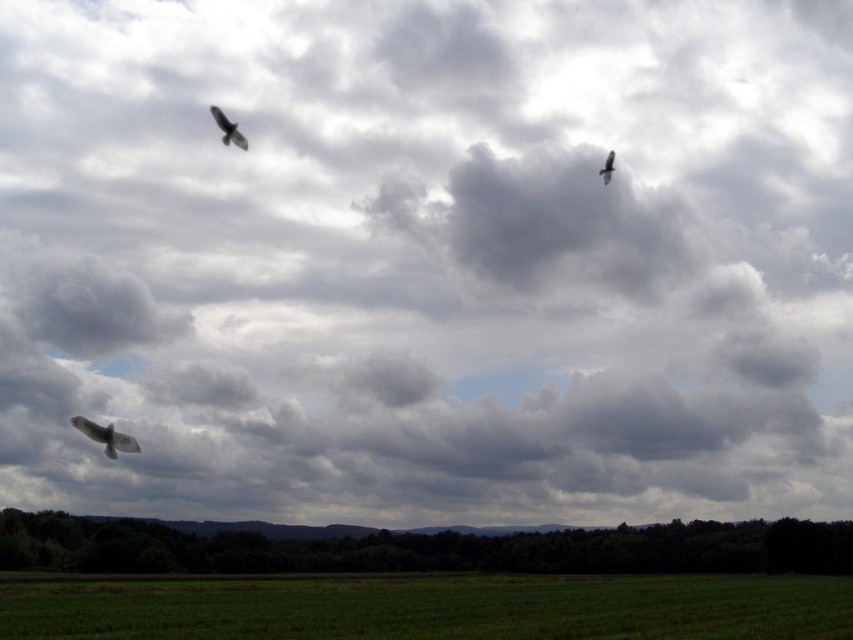
Question: Is green grassy field at lower center smaller than dark gray feathers at upper right?

Choices:
 (A) yes
 (B) no

Answer: (A)

Question: Estimate the real-world distances between objects in this image. Which object is closer to the dark gray feathers at upper left?

Choices:
 (A) white feathered bird at lower left
 (B) dark gray feathers at upper right
 (C) green grassy field at lower center

Answer: (A)

Question: Can you confirm if green grassy field at lower center is smaller than white feathered bird at lower left?

Choices:
 (A) yes
 (B) no

Answer: (B)

Question: Which point is farther to the camera?

Choices:
 (A) white feathered bird at lower left
 (B) dark gray feathers at upper left

Answer: (B)

Question: Which point is farther to the camera?

Choices:
 (A) green grassy field at lower center
 (B) dark gray feathers at upper right
 (C) dark gray feathers at upper left

Answer: (A)

Question: Can you confirm if green grassy field at lower center is bigger than white feathered bird at lower left?

Choices:
 (A) no
 (B) yes

Answer: (B)